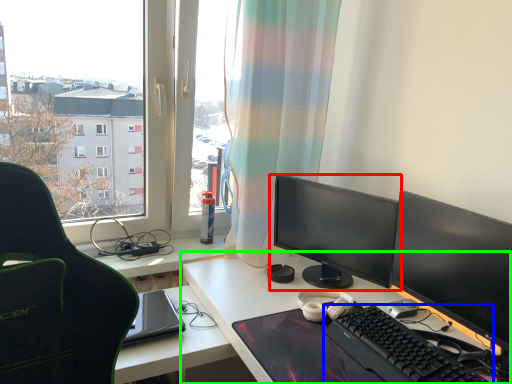
Question: Which object is the farthest from computer monitor (highlighted by a red box)? Choose among these: computer keyboard (highlighted by a blue box) or desk (highlighted by a green box).

Choices:
 (A) computer keyboard
 (B) desk

Answer: (A)